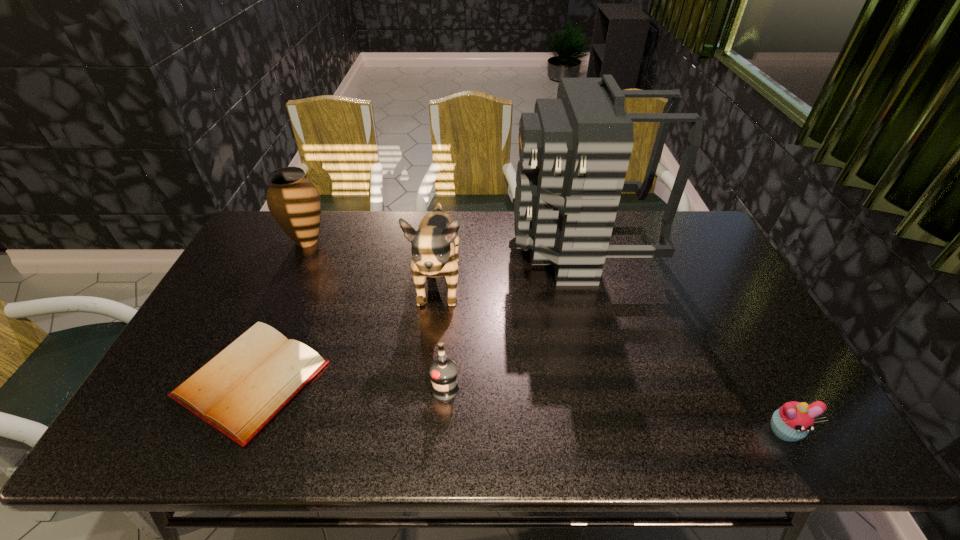
Select which object appears as the closest to the vodka. Please provide its 2D coordinates. Your answer should be formatted as a tuple, i.e. [(x, y)], where the tuple contains the x and y coordinates of a point satisfying the conditions above.

[(434, 249)]

Where is `free space that satisfies the following two spatial constraints: 1. on the front compartment of the second object from right to left; 2. on the front label of the fourth tallest object`? free space that satisfies the following two spatial constraints: 1. on the front compartment of the second object from right to left; 2. on the front label of the fourth tallest object is located at coordinates (615, 388).